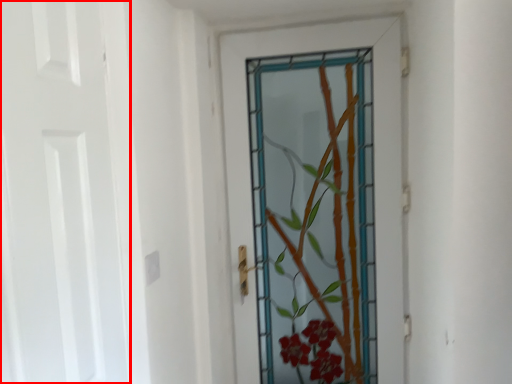
Question: From the image, what is the correct spatial relationship of door (annotated by the red box) in relation to door?

Choices:
 (A) right
 (B) left

Answer: (B)